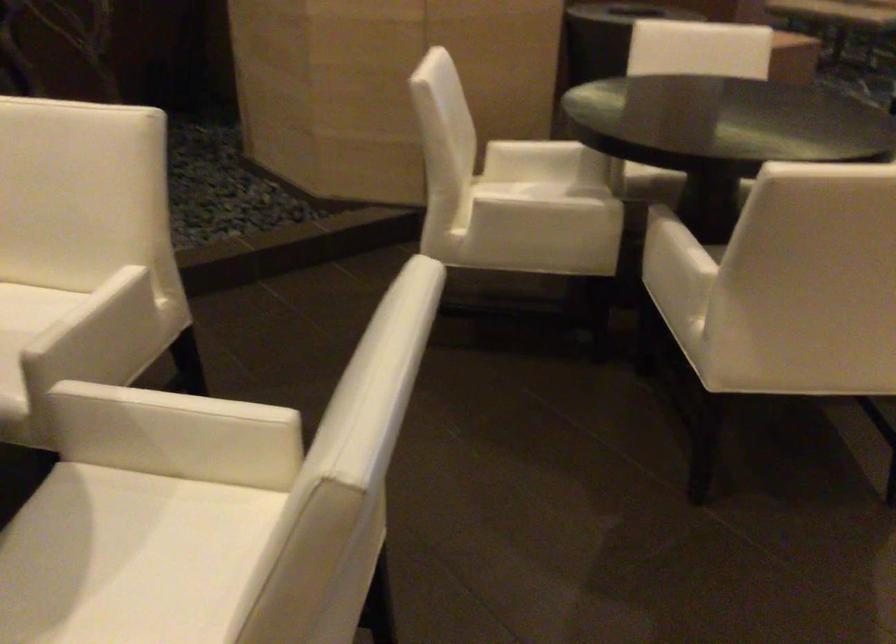
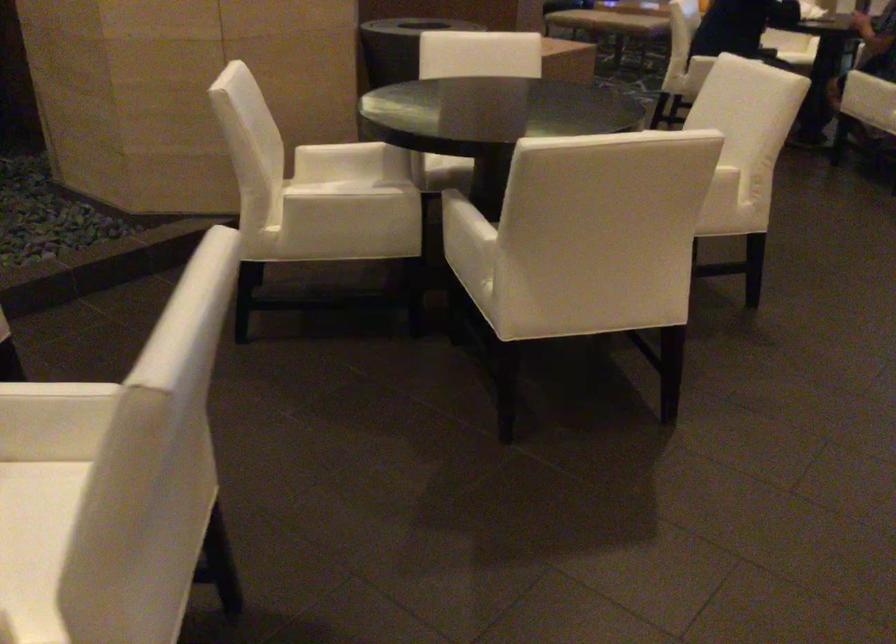
Question: The camera is either moving clockwise (left) or counter-clockwise (right) around the object. The first image is from the beginning of the video and the second image is from the end. Is the camera moving left or right when shooting the video?

Choices:
 (A) Left
 (B) Right

Answer: (A)